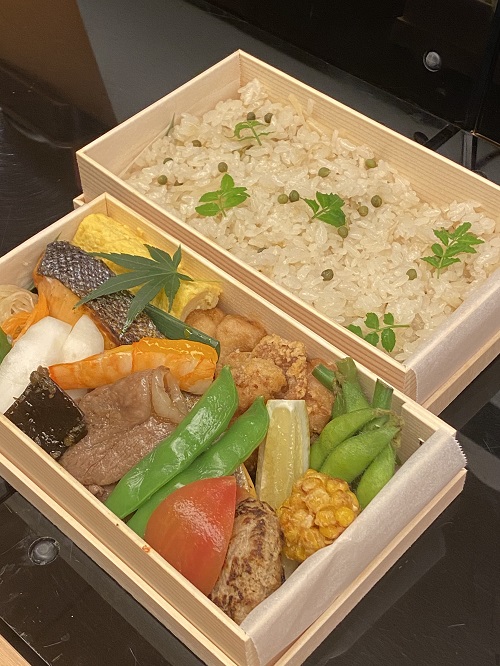
Where is `table`? table is located at coordinates (458, 563).